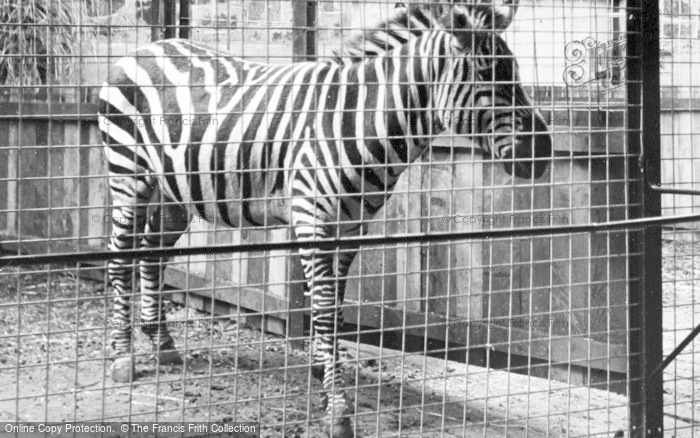
The height and width of the screenshot is (438, 700). Find the location of `mouse`. mouse is located at coordinates (514, 170).